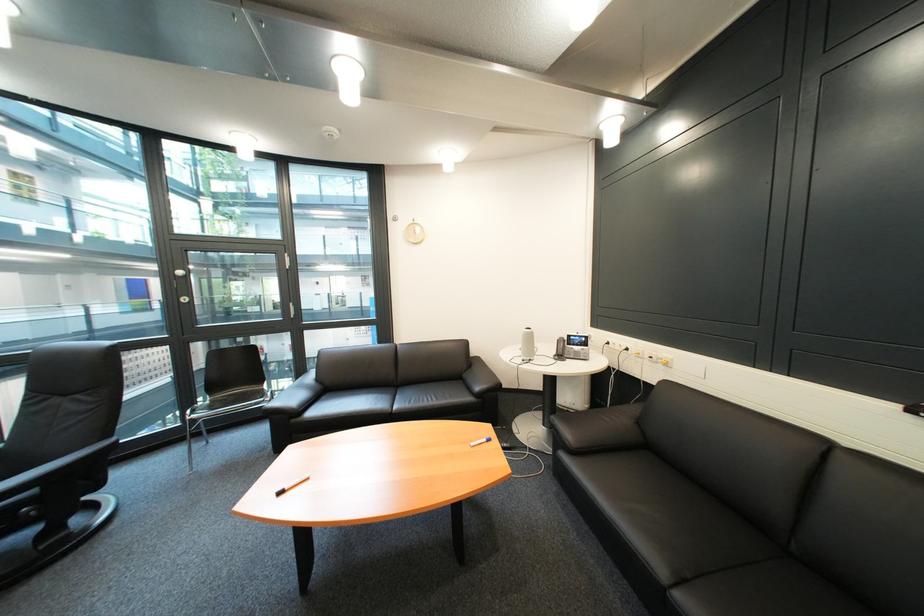
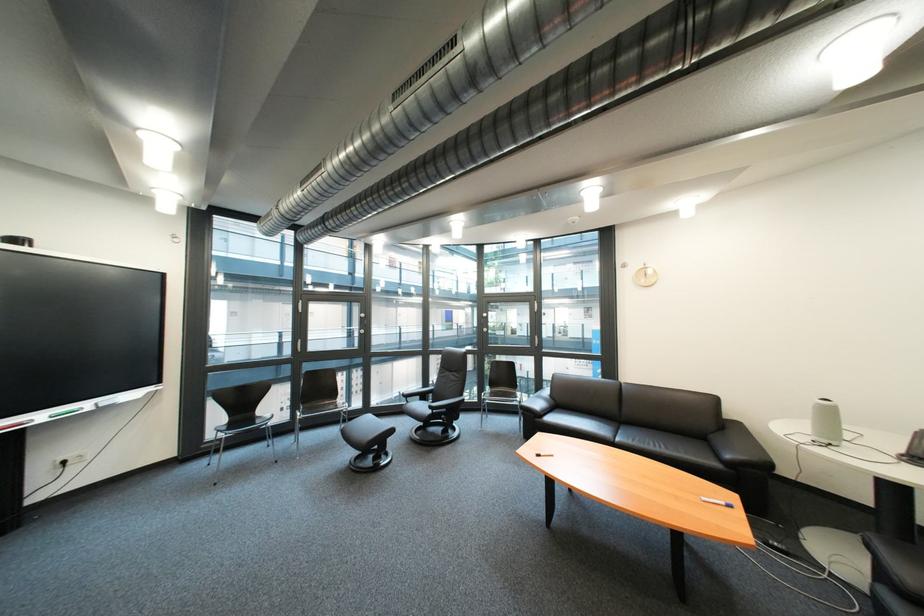
Locate, in the second image, the point that corresponds to the point at 410,399 in the first image.

(634, 434)